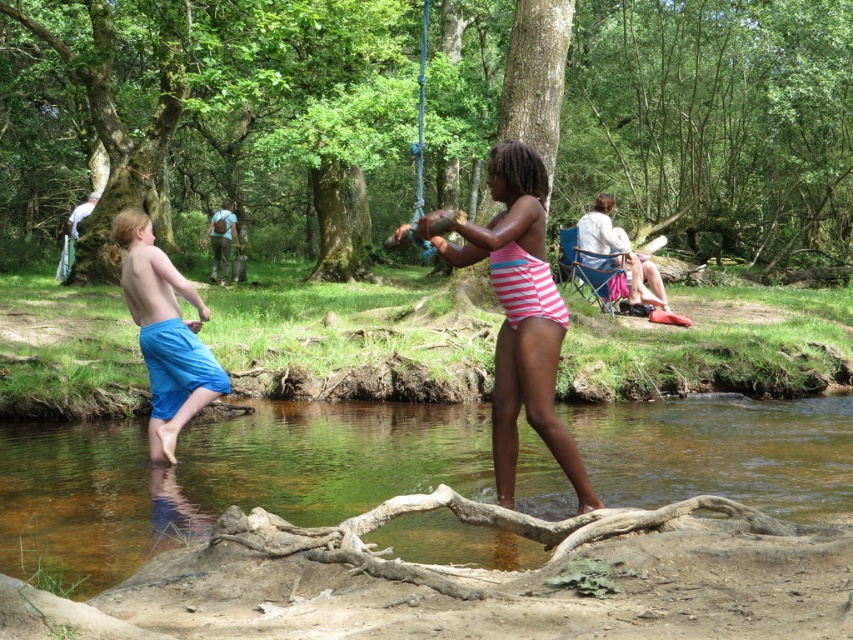
Does clear water at stream center have a smaller size compared to pink striped swimsuit at center?

Yes, clear water at stream center is smaller than pink striped swimsuit at center.

Who is lower down, clear water at stream center or pink striped swimsuit at center?

Answer: clear water at stream center is below.

Is point (668, 467) closer to camera compared to point (515, 400)?

No, (668, 467) is further to viewer.

Find the location of a particular element. clear water at stream center is located at coordinates (218, 477).

Can you confirm if pink striped swimsuit at center is smaller than blue fabric shorts at left?

Incorrect, pink striped swimsuit at center is not smaller in size than blue fabric shorts at left.

Between pink striped swimsuit at center and blue fabric shorts at left, which one has less height?

blue fabric shorts at left is shorter.

Is point (561, 321) farther from camera compared to point (164, 392)?

No.

Find the location of a particular element. Image resolution: width=853 pixels, height=640 pixels. pink striped swimsuit at center is located at coordinates (519, 314).

Which is above, clear water at stream center or blue fabric shorts at left?

blue fabric shorts at left is higher up.

Which is more to the left, clear water at stream center or blue fabric shorts at left?

From the viewer's perspective, clear water at stream center appears more on the left side.

Is point (428, 554) positioned in front of point (184, 348)?

Yes.

In order to click on clear water at stream center in this screenshot , I will do `click(218, 477)`.